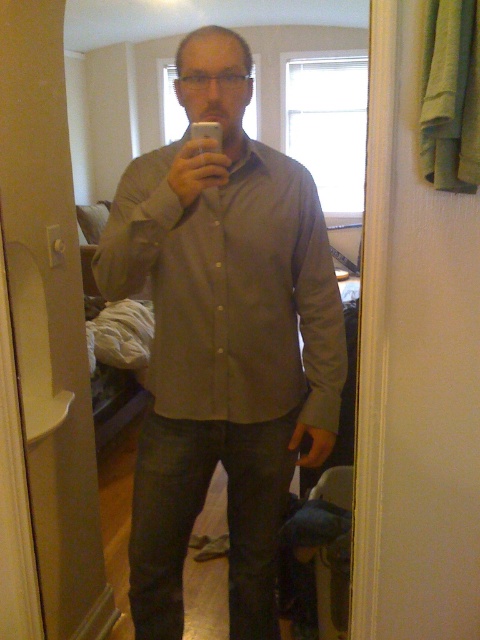
Question: Is matte brown shirt at center behind matte gray shirt at center?

Choices:
 (A) no
 (B) yes

Answer: (A)

Question: Is matte brown shirt at center smaller than matte gray shirt at center?

Choices:
 (A) yes
 (B) no

Answer: (B)

Question: Is matte brown shirt at center wider than matte gray shirt at center?

Choices:
 (A) yes
 (B) no

Answer: (A)

Question: Which point appears farthest from the camera in this image?

Choices:
 (A) (245, 364)
 (B) (166, 326)

Answer: (B)

Question: Which point is farther to the camera?

Choices:
 (A) (289, 228)
 (B) (273, 266)

Answer: (A)